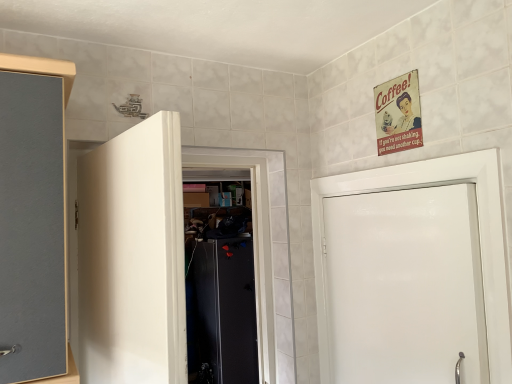
Question: In which direction should I rotate to look at white matte door at center, which ranks as the 2th door in right-to-left order?

Choices:
 (A) right
 (B) left

Answer: (B)

Question: Considering the relative sizes of white matte door at center, marked as the first door in a left-to-right arrangement, and white glossy door at right, positioned as the first door in right-to-left order, in the image provided, is white matte door at center, marked as the first door in a left-to-right arrangement, bigger than white glossy door at right, positioned as the first door in right-to-left order,?

Choices:
 (A) yes
 (B) no

Answer: (A)

Question: Is white glossy door at right, positioned as the first door in right-to-left order, at the back of white matte door at center, marked as the first door in a left-to-right arrangement?

Choices:
 (A) no
 (B) yes

Answer: (A)

Question: From a real-world perspective, is white matte door at center, which ranks as the 2th door in right-to-left order, positioned over white glossy door at right, positioned as the first door in right-to-left order, based on gravity?

Choices:
 (A) yes
 (B) no

Answer: (A)

Question: Can white glossy door at right, positioned as the first door in right-to-left order, be found inside white matte door at center, marked as the first door in a left-to-right arrangement?

Choices:
 (A) no
 (B) yes

Answer: (A)

Question: Is white matte door at center, marked as the first door in a left-to-right arrangement, behind white glossy door at right, the second door viewed from the left?

Choices:
 (A) yes
 (B) no

Answer: (B)

Question: Considering the relative positions of white matte door at center, which ranks as the 2th door in right-to-left order, and white glossy door at right, the second door viewed from the left, in the image provided, is white matte door at center, which ranks as the 2th door in right-to-left order, to the left of white glossy door at right, the second door viewed from the left, from the viewer's perspective?

Choices:
 (A) no
 (B) yes

Answer: (B)

Question: Does white glossy door at right, positioned as the first door in right-to-left order, have a greater height compared to white matte door at center, which ranks as the 2th door in right-to-left order?

Choices:
 (A) no
 (B) yes

Answer: (B)

Question: Can you confirm if white glossy door at right, the second door viewed from the left, is bigger than white matte door at center, marked as the first door in a left-to-right arrangement?

Choices:
 (A) yes
 (B) no

Answer: (B)

Question: Is white glossy door at right, the second door viewed from the left, to the right of white matte door at center, which ranks as the 2th door in right-to-left order, from the viewer's perspective?

Choices:
 (A) yes
 (B) no

Answer: (A)

Question: Considering the relative sizes of white glossy door at right, the second door viewed from the left, and white matte door at center, which ranks as the 2th door in right-to-left order, in the image provided, is white glossy door at right, the second door viewed from the left, shorter than white matte door at center, which ranks as the 2th door in right-to-left order,?

Choices:
 (A) no
 (B) yes

Answer: (A)

Question: From the image's perspective, does white glossy door at right, the second door viewed from the left, appear lower than white matte door at center, which ranks as the 2th door in right-to-left order?

Choices:
 (A) no
 (B) yes

Answer: (B)

Question: Is white glossy door at right, the second door viewed from the left, smaller than white matte door at center, which ranks as the 2th door in right-to-left order?

Choices:
 (A) no
 (B) yes

Answer: (B)

Question: Would you say white glossy door at right, the second door viewed from the left, is to the left or to the right of white matte door at center, marked as the first door in a left-to-right arrangement, in the picture?

Choices:
 (A) left
 (B) right

Answer: (B)